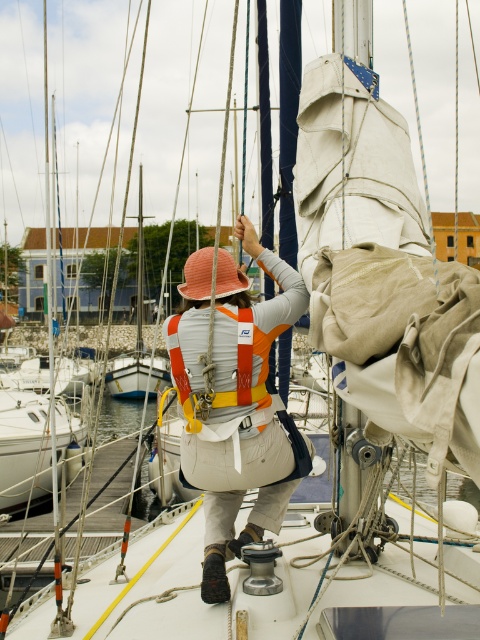
Question: Is orange fabric life vest at center to the left of orange fabric safety vest at center from the viewer's perspective?

Choices:
 (A) yes
 (B) no

Answer: (B)

Question: Which of the following is the farthest from the observer?

Choices:
 (A) orange fabric life vest at center
 (B) orange fabric safety vest at center

Answer: (B)

Question: Is orange fabric life vest at center positioned before orange fabric safety vest at center?

Choices:
 (A) no
 (B) yes

Answer: (B)

Question: Among these objects, which one is farthest from the camera?

Choices:
 (A) orange fabric safety vest at center
 (B) orange fabric life vest at center

Answer: (A)

Question: Does orange fabric life vest at center have a smaller size compared to orange fabric safety vest at center?

Choices:
 (A) no
 (B) yes

Answer: (A)

Question: Which point is farther to the camera?

Choices:
 (A) orange fabric safety vest at center
 (B) orange fabric life vest at center

Answer: (A)